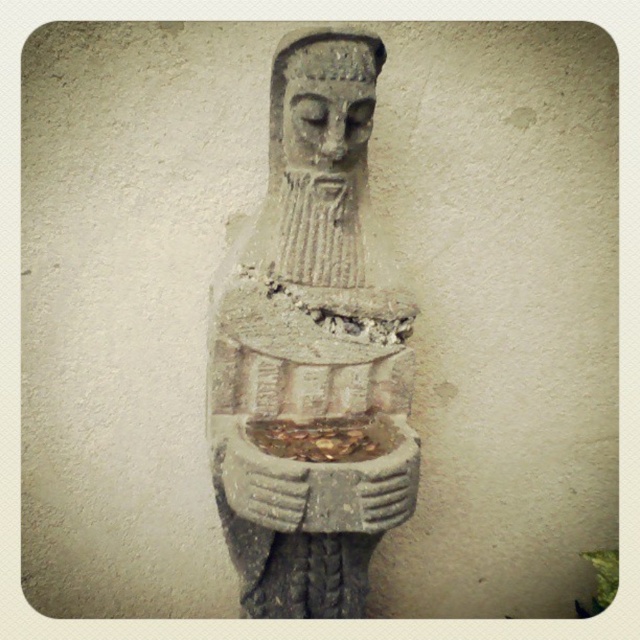
Does gray stone statue at center come in front of gray stone head at center?

Yes, gray stone statue at center is in front of gray stone head at center.

Locate an element on the screen. gray stone statue at center is located at coordinates (310, 353).

Does point (316, 566) lie in front of point (353, 38)?

No, (316, 566) is further to viewer.

Find the location of `gray stone statue at center`. gray stone statue at center is located at coordinates (310, 353).